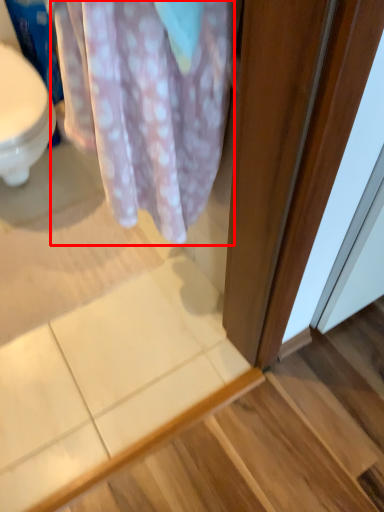
Question: In this image, where is blanket (annotated by the red box) located relative to stair?

Choices:
 (A) right
 (B) left

Answer: (B)